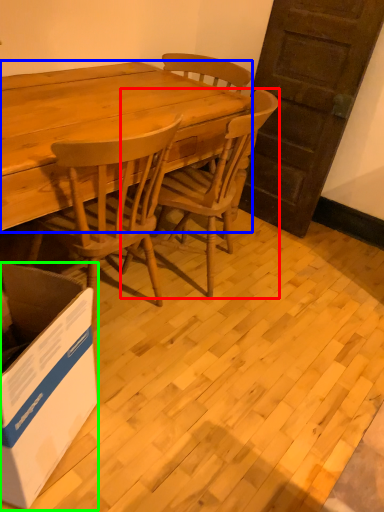
Question: Based on their relative distances, which object is farther from chair (highlighted by a red box)? Choose from desk (highlighted by a blue box) and box (highlighted by a green box).

Choices:
 (A) desk
 (B) box

Answer: (B)